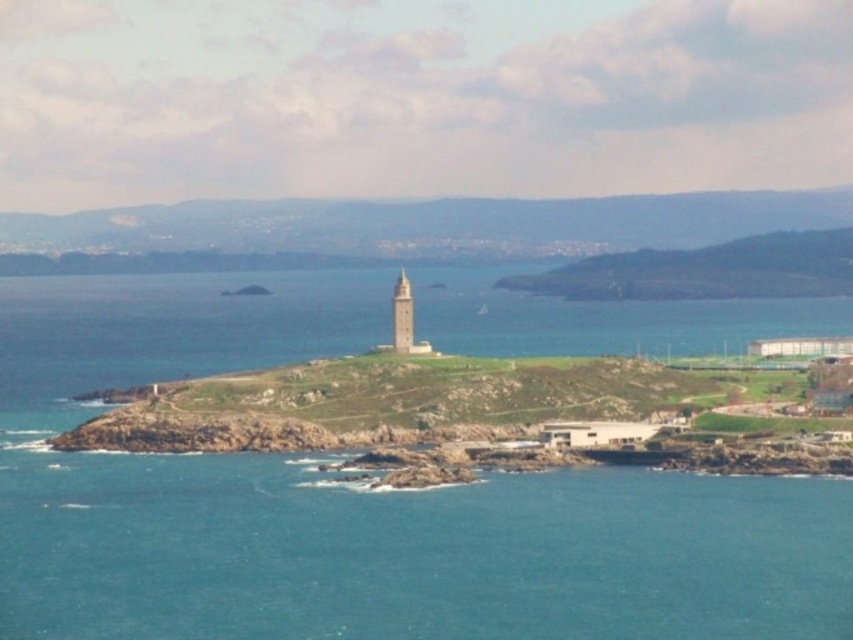
You are a photographer planning to capture the white stone tower at center and the blue water at center in a single frame. Based on the scene, which object occupies a larger portion of the vertical space in the image?

The blue water at center is much taller than the white stone tower at center, so it occupies a larger portion of the vertical space in the image.

You are standing at the bottom of the hill where the Torre de HERCULES is located. You want to walk to the blue water at center. Which direction should you head towards?

The blue water at center is located at point (x=357, y=502), so you should head towards the right direction from the tower to reach it.